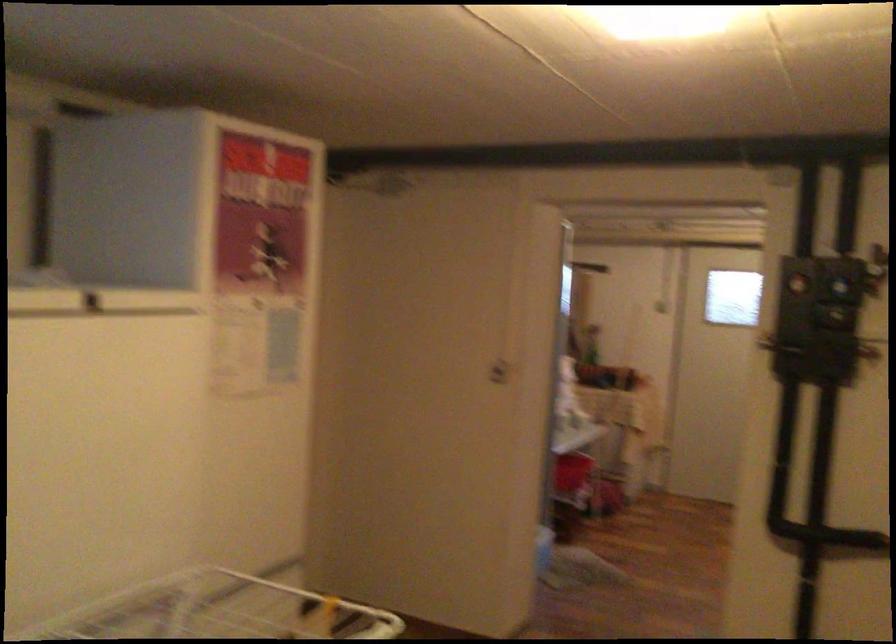
The width and height of the screenshot is (896, 644). What do you see at coordinates (840, 281) in the screenshot? I see `the blue control dial` at bounding box center [840, 281].